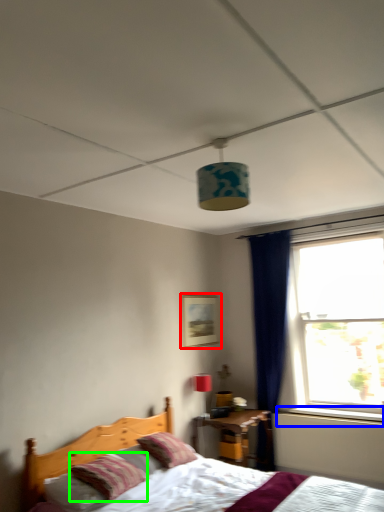
Question: Estimate the real-world distances between objects in this image. Which object is farther from picture frame (highlighted by a red box), window sill (highlighted by a blue box) or pillow (highlighted by a green box)?

Choices:
 (A) window sill
 (B) pillow

Answer: (B)